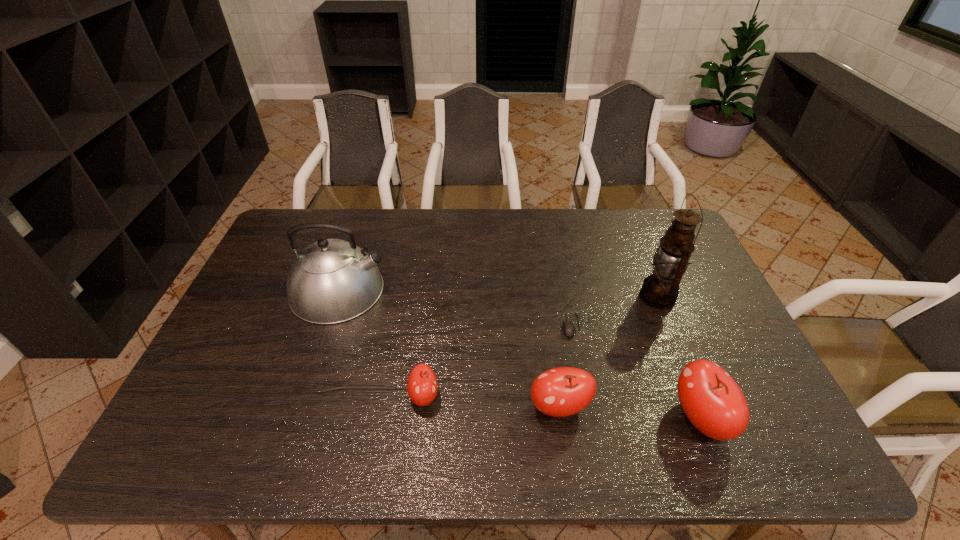
In the image, there is a desktop. Where is `free space at the near edge`? The image size is (960, 540). free space at the near edge is located at coordinates (468, 417).

Identify the location of vacant region at the right edge of the desktop. (687, 270).

Identify the location of free region at the far right corner. (670, 226).

Where is `empty location between the tallest object and the shortest apple`? empty location between the tallest object and the shortest apple is located at coordinates (540, 346).

The image size is (960, 540). I want to click on free area in between the second tallest object and the rightmost apple, so click(x=519, y=354).

This screenshot has width=960, height=540. Find the location of `empty location between the second shortest object and the kettle`. empty location between the second shortest object and the kettle is located at coordinates (381, 343).

The width and height of the screenshot is (960, 540). I want to click on unoccupied area between the rightmost apple and the second tallest object, so click(519, 354).

Where is `free space between the leftmost object and the tallest object`? The height and width of the screenshot is (540, 960). free space between the leftmost object and the tallest object is located at coordinates (498, 293).

What are the coordinates of `vacant space that is in between the tallest object and the fifth tallest object` in the screenshot? It's located at (540, 346).

Identify the location of free spot between the tallest object and the fourth tallest object. Image resolution: width=960 pixels, height=540 pixels. (608, 352).